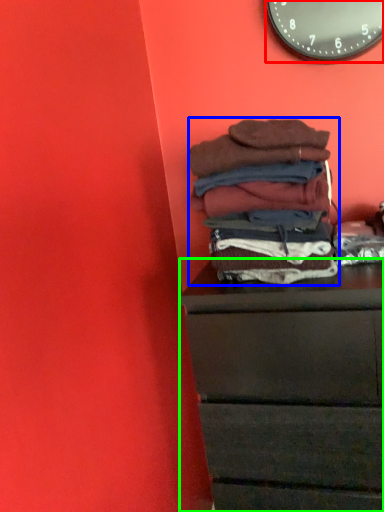
Question: Considering the real-world distances, which object is farthest from wall clock (highlighted by a red box)? material (highlighted by a blue box) or chest of drawers (highlighted by a green box)?

Choices:
 (A) material
 (B) chest of drawers

Answer: (B)